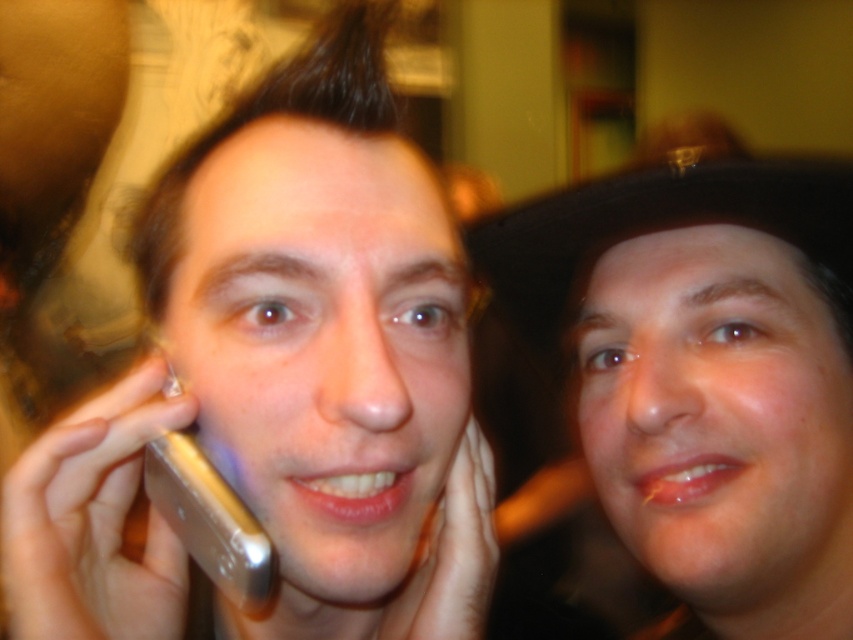
Does silver metallic phone at left come behind matte black hat at upper right?

No, silver metallic phone at left is in front of matte black hat at upper right.

Identify the location of silver metallic phone at left. (283, 380).